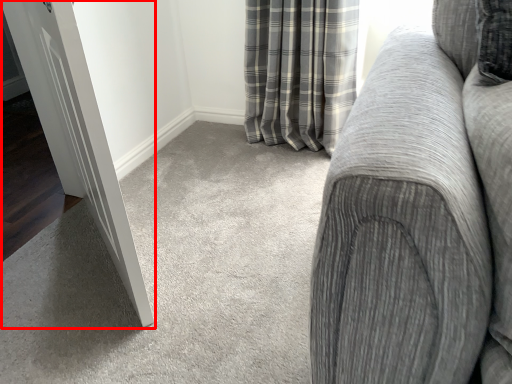
Question: Observing the image, what is the correct spatial positioning of door (annotated by the red box) in reference to studio couch?

Choices:
 (A) left
 (B) right

Answer: (A)